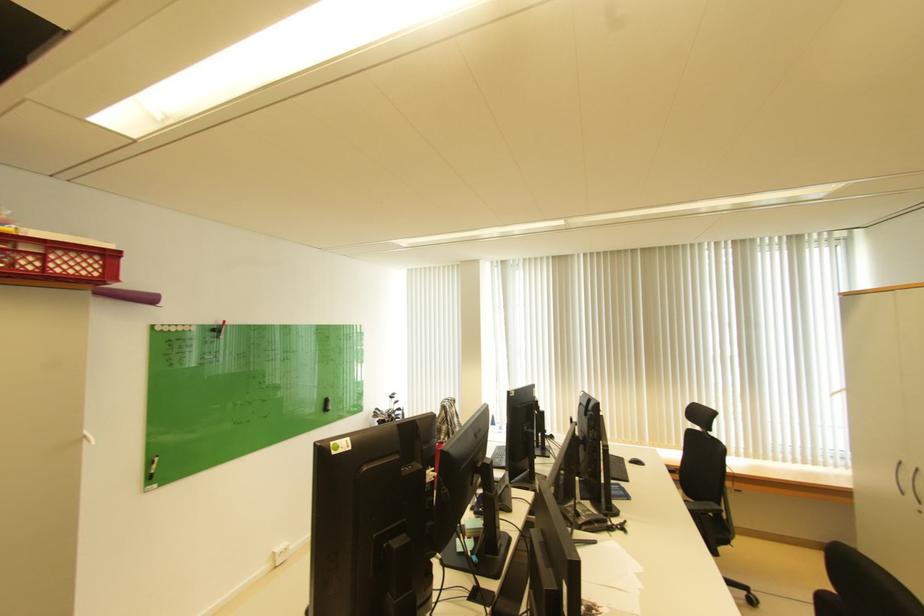
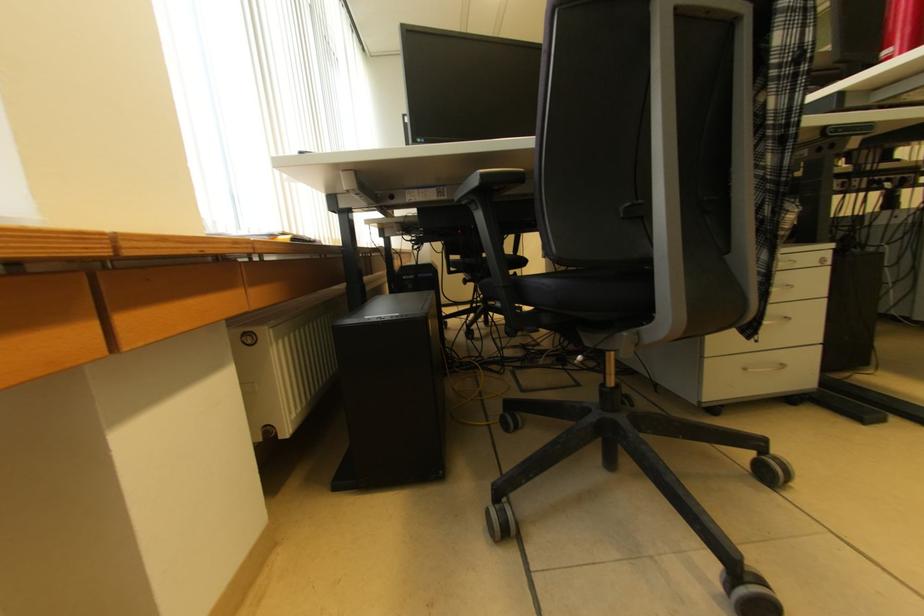
Question: I am providing you with two images of the same scene from different viewpoints. Please identify which objects are invisible in image2.

Choices:
 (A) white tissue roll
 (B) black computer mouse
 (C) chair armrest
 (D) drawer handle

Answer: (B)